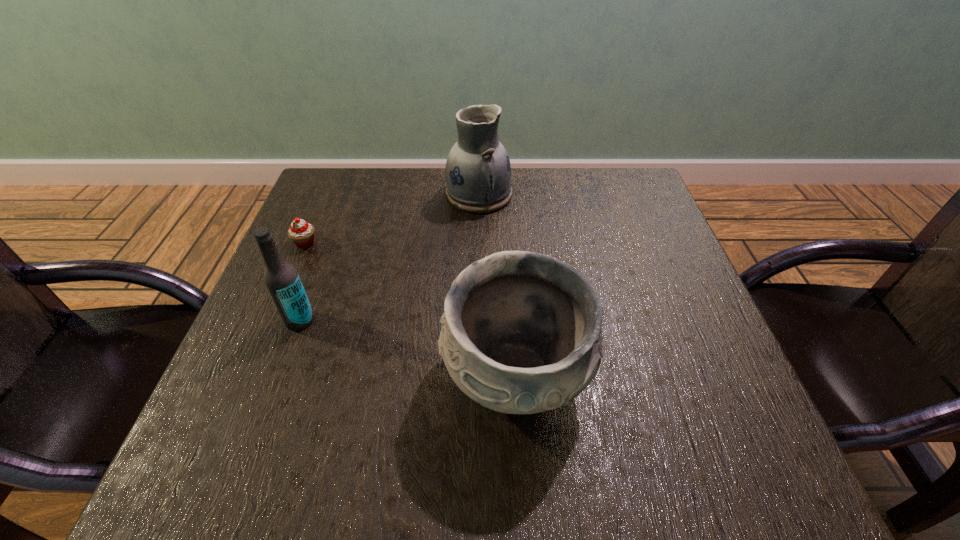
Where is `vacant space at the far right corner of the desktop`? vacant space at the far right corner of the desktop is located at coordinates (635, 192).

At what (x,y) coordinates should I click in order to perform the action: click on free space between the shortest object and the farther pottery. Please return your answer as a coordinate pair (x, y). Looking at the image, I should click on (393, 219).

Locate an element on the screen. empty location between the second shortest object and the beer bottle is located at coordinates (408, 348).

At what (x,y) coordinates should I click in order to perform the action: click on empty space that is in between the second farthest object and the taller pottery. Please return your answer as a coordinate pair (x, y). The width and height of the screenshot is (960, 540). Looking at the image, I should click on (393, 219).

At what (x,y) coordinates should I click in order to perform the action: click on free space between the cupcake and the farthest object. Please return your answer as a coordinate pair (x, y). The height and width of the screenshot is (540, 960). Looking at the image, I should click on [393, 219].

Where is `free point between the third nearest object and the third tallest object`? This screenshot has width=960, height=540. free point between the third nearest object and the third tallest object is located at coordinates (410, 309).

Find the location of a particular element. free point between the cupcake and the taller pottery is located at coordinates (393, 219).

This screenshot has height=540, width=960. Identify the location of free area in between the nearer pottery and the second farthest object. (410, 309).

The image size is (960, 540). In order to click on empty location between the cupcake and the nearer pottery in this screenshot , I will do `click(410, 309)`.

Where is `object that stands as the third closest to the nearer pottery`? object that stands as the third closest to the nearer pottery is located at coordinates (302, 233).